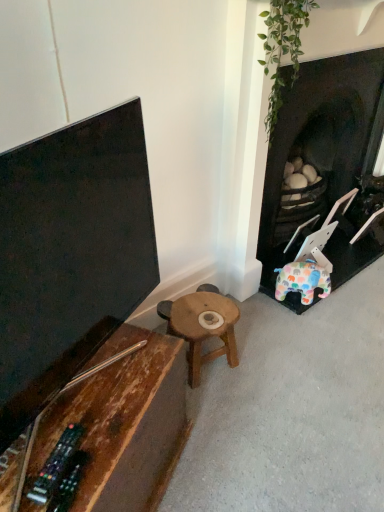
What are the coordinates of `free space above rustic wood table at lower left, the first table in the front-to-back sequence (from a real-world perspective)` in the screenshot? It's located at (92, 399).